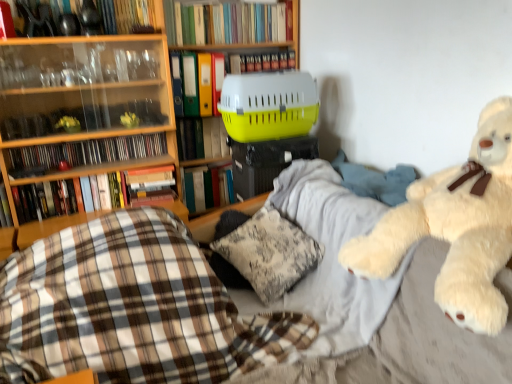
Question: From the image's perspective, relative to hardcover book at left, placed as the 8th book when sorted from top to bottom, is yellow plastic pet carrier at center, which is counted as the fifth book, starting from the top, above or below?

Choices:
 (A) below
 (B) above

Answer: (B)

Question: Considering the positions of yellow plastic pet carrier at center, positioned as the fifth book in bottom-to-top order, and hardcover book at left, placed as the 8th book when sorted from top to bottom, in the image, is yellow plastic pet carrier at center, positioned as the fifth book in bottom-to-top order, wider or thinner than hardcover book at left, placed as the 8th book when sorted from top to bottom,?

Choices:
 (A) thin
 (B) wide

Answer: (A)

Question: Based on their relative distances, which object is nearer to the yellow plastic pet carrier at center?

Choices:
 (A) fluffy white teddy bear at right
 (B) fluffy white pillow at center
 (C) hardcover book at left, which is the 2th book in bottom-to-top order
 (D) hardcover book at center, the 3th book ordered from the bottom
 (E) hardcover book at left, which is the 9th book in top-to-bottom order

Answer: (D)

Question: Which of these objects is positioned farthest from the hardcover book at left, placed as the 8th book when sorted from top to bottom?

Choices:
 (A) hardcover book at center, the 3th book ordered from the bottom
 (B) plaid fabric at center
 (C) yellow plastic pet carrier at center, which is counted as the fifth book, starting from the top
 (D) yellow plastic file at center, marked as the sixth book in a bottom-to-top arrangement
 (E) hardcover book at upper center, which appears as the 1th book when viewed from the top

Answer: (B)